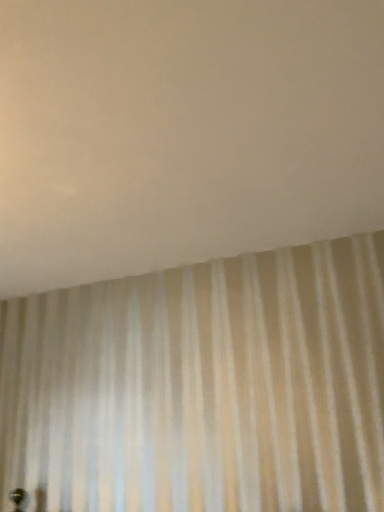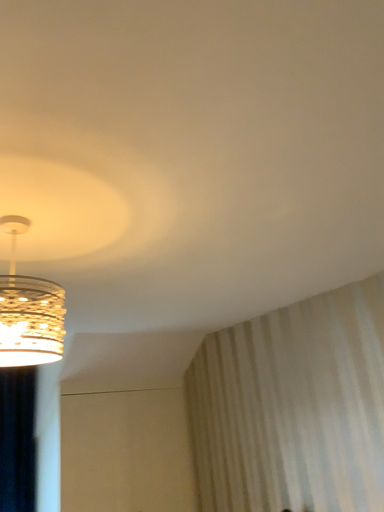
Question: Which way did the camera rotate in the video?

Choices:
 (A) rotated right
 (B) rotated left

Answer: (B)